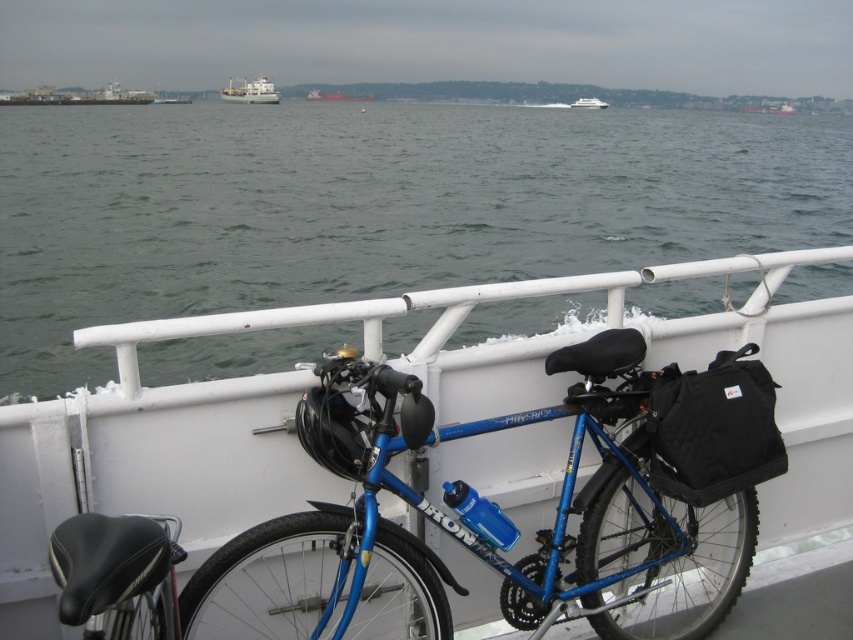
You are standing on the deck of the boat and want to take a photo of the gray water at center and the white glossy boat at upper center. Which object should you focus on first if you want to capture both in a single frame without moving the camera?

The gray water at center is to the left of the white glossy boat at upper center, so you should focus on the gray water at center first since it is closer to the left edge of the frame, allowing both objects to be captured in a single shot without moving the camera.

You are standing on the deck of the boat and want to take a photo of the white glossy boat at upper center without the gray water at center appearing in the foreground. Is this possible?

The gray water at center is closer to the viewer than the white glossy boat at upper center. To avoid the gray water at center in the foreground, you would need to adjust your position or angle so that the gray water at center is not between you and the white glossy boat at upper center.

You are standing on the deck of the boat and want to place a small potted plant between the gray water at center and the blue metallic bicycle at center. Based on their heights, which object should the plant be placed closer to?

The gray water at center is taller than the blue metallic bicycle at center, so the plant should be placed closer to the blue metallic bicycle at center to ensure it remains visible and stable.